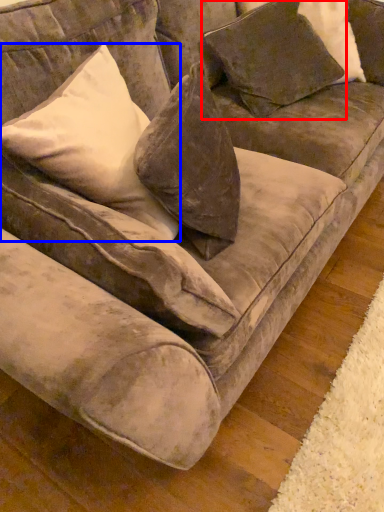
Question: Which point is further to the camera, pillow (highlighted by a red box) or pillow (highlighted by a blue box)?

Choices:
 (A) pillow
 (B) pillow

Answer: (A)